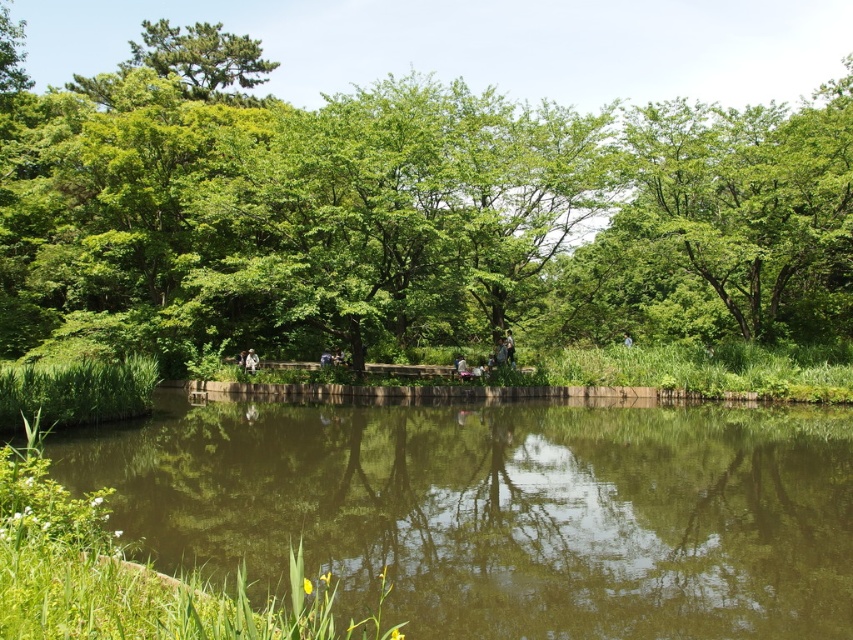
In the scene shown: Which is above, green reflective water at center or green leafy tree at upper left?

Positioned higher is green leafy tree at upper left.

How much distance is there between green reflective water at center and green leafy tree at upper left?

The distance of green reflective water at center from green leafy tree at upper left is 37.13 meters.

Image resolution: width=853 pixels, height=640 pixels. In order to click on green reflective water at center in this screenshot , I will do `click(500, 509)`.

Can you confirm if green leafy tree at center is positioned to the left of green reflective water at center?

Correct, you'll find green leafy tree at center to the left of green reflective water at center.

Is point (213, 266) less distant than point (306, 502)?

No, (213, 266) is further to viewer.

Between point (720, 326) and point (816, 438), which one is positioned behind?

The point (720, 326) is more distant.

Identify the location of green leafy tree at center. (408, 218).

Does green leafy tree at center have a greater width compared to green leafy tree at upper left?

Yes.

Can you confirm if green leafy tree at center is thinner than green leafy tree at upper left?

No.

Between point (706, 147) and point (189, 45), which one is positioned behind?

The point (189, 45) is more distant.

Identify the location of green leafy tree at center. The image size is (853, 640). (408, 218).